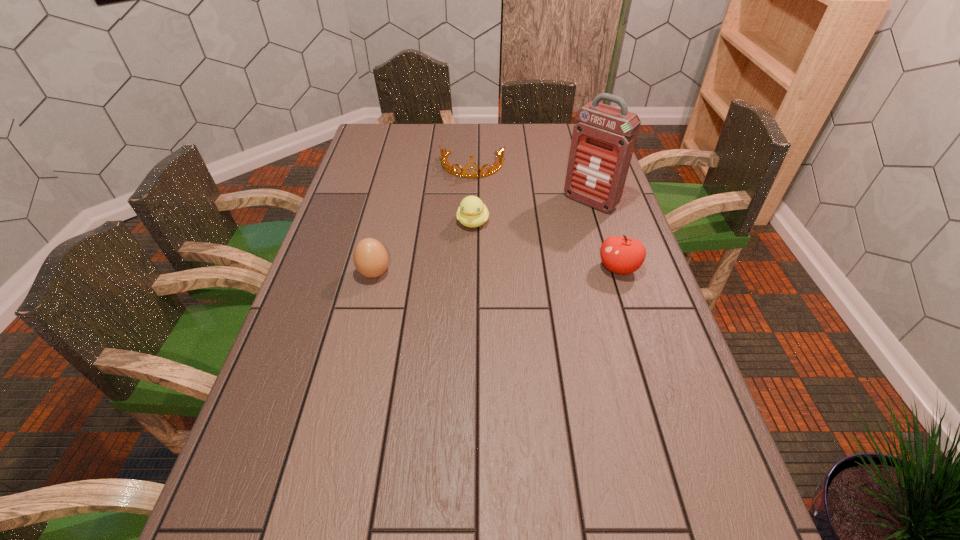
Locate an element on the screen. boiled egg is located at coordinates (370, 257).

Locate an element on the screen. This screenshot has height=540, width=960. apple is located at coordinates (621, 255).

Where is `the tallest object`? This screenshot has width=960, height=540. the tallest object is located at coordinates 603,141.

At what (x,y) coordinates should I click in order to perform the action: click on tiara. Please return your answer as a coordinate pair (x, y). The image size is (960, 540). Looking at the image, I should click on (447, 167).

Locate an element on the screen. This screenshot has width=960, height=540. duckling is located at coordinates (472, 213).

The height and width of the screenshot is (540, 960). What are the coordinates of `vacant space positioned on the right of the boiled egg` in the screenshot? It's located at (523, 273).

This screenshot has width=960, height=540. What are the coordinates of `vacant space situated on the front of the apple` in the screenshot? It's located at point(655,383).

The height and width of the screenshot is (540, 960). I want to click on vacant region located on the front-facing side of the tallest object, so click(552, 237).

Locate an element on the screen. The height and width of the screenshot is (540, 960). vacant space situated on the front-facing side of the tallest object is located at coordinates (519, 267).

This screenshot has height=540, width=960. In order to click on vacant space situated on the front-facing side of the tallest object in this screenshot , I will do `click(538, 251)`.